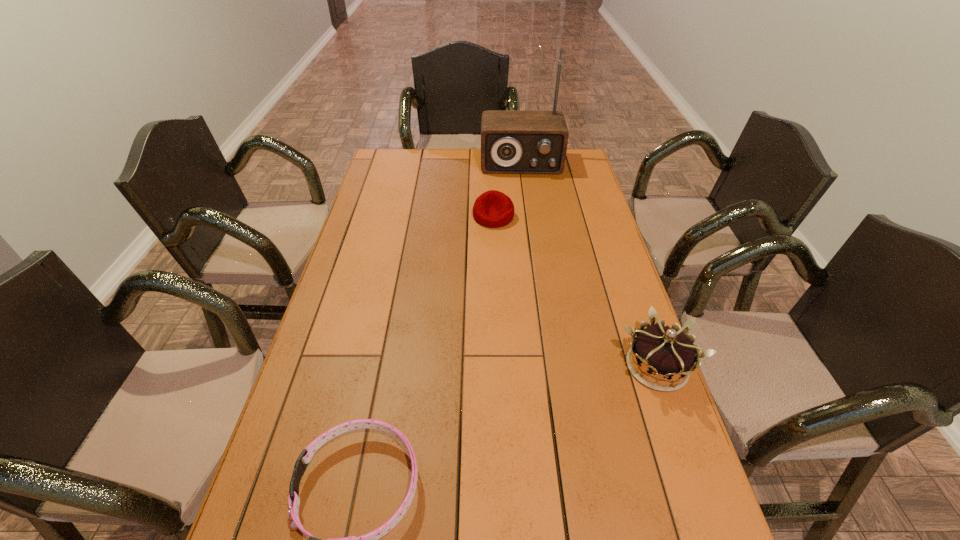
Where is `vacant space in between the tallest object and the third nearest object`? The image size is (960, 540). vacant space in between the tallest object and the third nearest object is located at coordinates (507, 190).

Identify the location of vacant point located between the beanbag and the rightmost object. The width and height of the screenshot is (960, 540). (575, 292).

The image size is (960, 540). Find the location of `vacant space that is in between the crown and the second shortest object`. vacant space that is in between the crown and the second shortest object is located at coordinates (575, 292).

Identify the location of free space between the beanbag and the crown. This screenshot has height=540, width=960. (575, 292).

Locate an element on the screen. free space between the third tallest object and the third farthest object is located at coordinates (575, 292).

Where is `empty location between the third farthest object and the tallest object`? empty location between the third farthest object and the tallest object is located at coordinates (589, 265).

Point out which object is positioned as the nearest to the second nearest object. Please provide its 2D coordinates. Your answer should be formatted as a tuple, i.e. [(x, y)], where the tuple contains the x and y coordinates of a point satisfying the conditions above.

[(370, 539)]

Locate an element on the screen. This screenshot has width=960, height=540. object that can be found as the second closest to the radio receiver is located at coordinates (664, 352).

You are a GUI agent. You are given a task and a screenshot of the screen. Output one action in this format:
    pyautogui.click(x=<x>, y=<y>)
    Task: Click on the vacant region that satisfies the following two spatial constraints: 1. on the front side of the third nearest object; 2. on the right side of the second tallest object
    The image size is (960, 540).
    Given the screenshot: What is the action you would take?
    pyautogui.click(x=499, y=367)